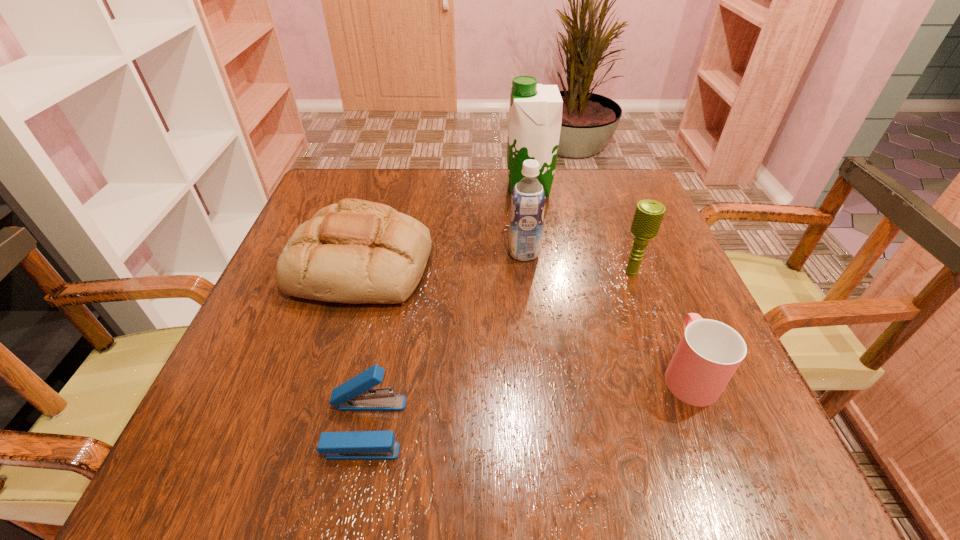
Where is `the tallest object`? the tallest object is located at coordinates (535, 114).

The height and width of the screenshot is (540, 960). Identify the location of the taller soya milk. (535, 114).

Where is `the second tallest object`? the second tallest object is located at coordinates (528, 198).

Image resolution: width=960 pixels, height=540 pixels. I want to click on the nearer soya milk, so click(x=528, y=198).

In order to click on the third tallest object in this screenshot , I will do `click(648, 216)`.

Identify the location of the fourth tallest object. (357, 251).

The image size is (960, 540). I want to click on the second shortest object, so click(709, 352).

This screenshot has width=960, height=540. I want to click on the shortest object, so click(x=357, y=394).

Image resolution: width=960 pixels, height=540 pixels. Find the location of `blank space located 0.120m on the front-facing side of the farther soya milk`. blank space located 0.120m on the front-facing side of the farther soya milk is located at coordinates (460, 187).

Identify the location of free location located 0.140m on the front-facing side of the farther soya milk. The height and width of the screenshot is (540, 960). (452, 187).